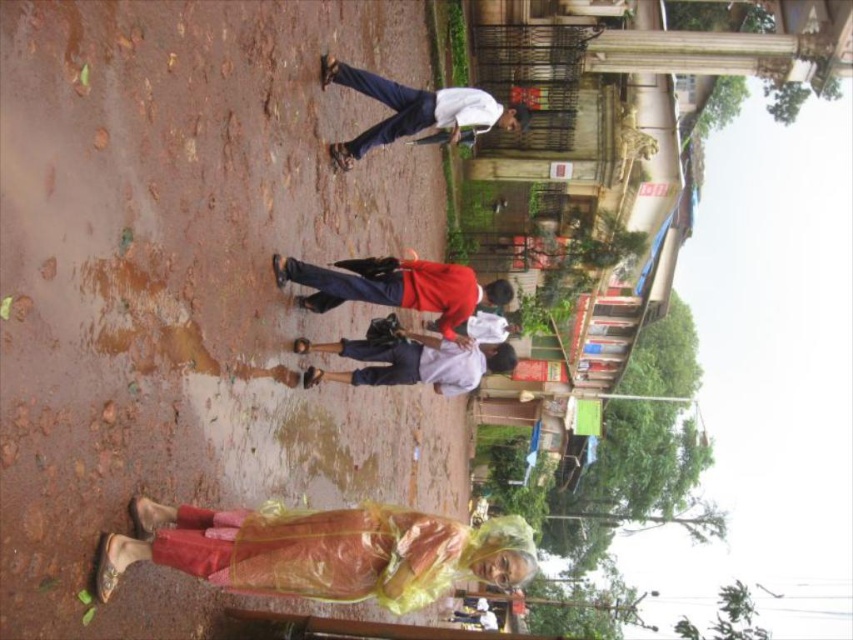
Question: Can you confirm if red fabric shirt at center is smaller than white cotton shirt at upper center?

Choices:
 (A) yes
 (B) no

Answer: (A)

Question: Which of the following is the closest to the observer?

Choices:
 (A) white cotton shirt at center
 (B) translucent yellow raincoat at lower center
 (C) white cotton shirt at upper center

Answer: (B)

Question: Which of the following is the farthest from the observer?

Choices:
 (A) (357, 292)
 (B) (405, 125)
 (C) (323, 349)
 (D) (125, 538)

Answer: (B)

Question: Which of the following is the closest to the observer?

Choices:
 (A) (364, 381)
 (B) (518, 120)
 (C) (350, 275)
 (D) (379, 538)

Answer: (D)

Question: Where is translucent yellow raincoat at lower center located in relation to white cotton shirt at center in the image?

Choices:
 (A) right
 (B) left

Answer: (B)

Question: Considering the relative positions of translucent yellow raincoat at lower center and red fabric shirt at center in the image provided, where is translucent yellow raincoat at lower center located with respect to red fabric shirt at center?

Choices:
 (A) above
 (B) below

Answer: (B)